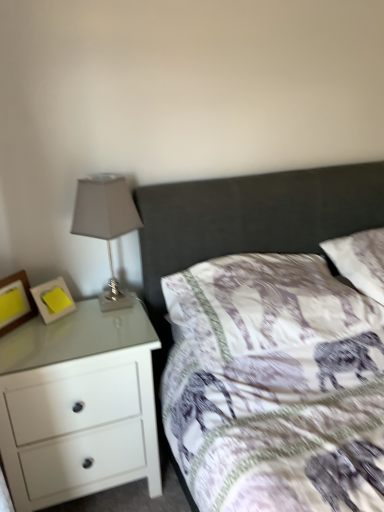
Question: In the image, is white glossy chest of drawers at left positioned in front of or behind wooden picture frame at left, which is counted as the 2th picture frame, starting from the right?

Choices:
 (A) front
 (B) behind

Answer: (A)

Question: From a real-world perspective, relative to wooden picture frame at left, which is counted as the 2th picture frame, starting from the right, is white glossy chest of drawers at left vertically above or below?

Choices:
 (A) below
 (B) above

Answer: (A)

Question: Which is farther from the white soft pillow at upper right, acting as the 1th pillow starting from the right?

Choices:
 (A) matte gray glass table lamp at left
 (B) wooden picture frame at left, which is counted as the 2th picture frame, starting from the right
 (C) white fabric pillow at center, the first pillow positioned from the left
 (D) white glossy chest of drawers at left
 (E) yellow paper at left, marked as the 1th picture frame in a right-to-left arrangement

Answer: (B)

Question: Estimate the real-world distances between objects in this image. Which object is farther from the white soft pillow at upper right, which appears as the second pillow when viewed from the left?

Choices:
 (A) white glossy chest of drawers at left
 (B) white fabric pillow at center, placed as the 2th pillow when sorted from right to left
 (C) yellow paper at left, which is counted as the 2th picture frame, starting from the left
 (D) matte gray glass table lamp at left
 (E) wooden picture frame at left, marked as the first picture frame in a left-to-right arrangement

Answer: (E)